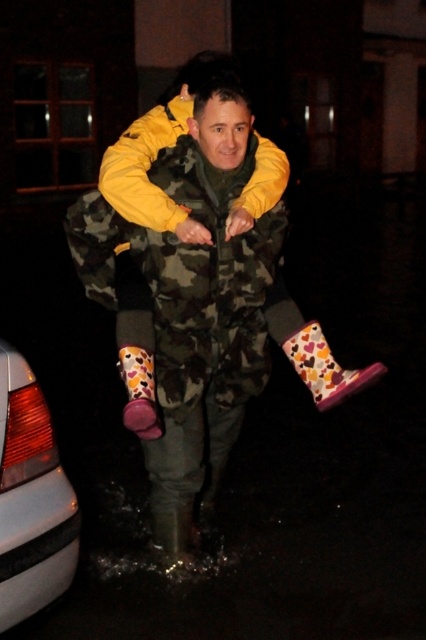
You are a photographer taking a picture of the multicolored rubber boot at lower center and the floral rubber boot at lower center. Which boot should you focus on if you want to capture the one that appears larger in the photo?

The multicolored rubber boot at lower center is much taller than the floral rubber boot at lower center, so you should focus on the multicolored rubber boot at lower center to capture the larger one.

You are a delivery person who needs to place a small package between the white glossy car at lower left and the floral rubber boot at lower center. Can you fit the package there if it measures 1 foot in length?

The distance between the white glossy car at lower left and the floral rubber boot at lower center is 18.79 inches. Since 1 foot equals 12 inches, the package can fit in the space between them.

You are a delivery robot with a width of 24 inches. You need to pass between the multicolored rubber boot at lower center and the floral rubber boot at lower center. Can you fit through the space between them?

The distance between the multicolored rubber boot at lower center and the floral rubber boot at lower center is 28.94 inches. Since the robot is 24 inches wide, it can fit through the space as the distance is wider than the robot.